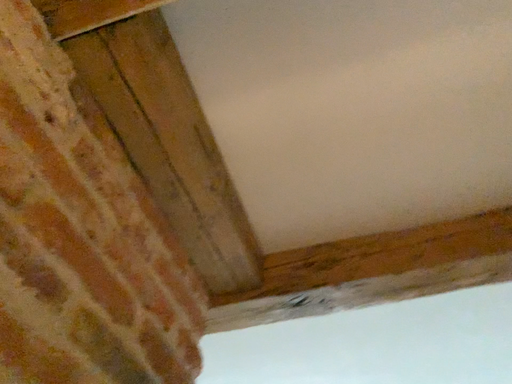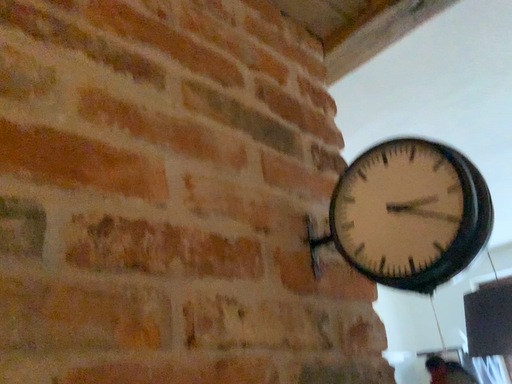
Question: How did the camera likely rotate when shooting the video?

Choices:
 (A) rotated left
 (B) rotated right

Answer: (A)